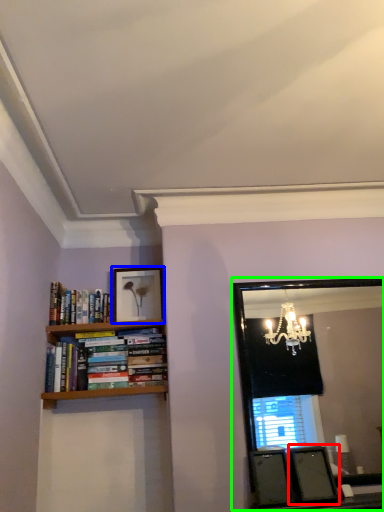
Question: Based on their relative distances, which object is farther from picture frame (highlighted by a red box)? Choose from picture frame (highlighted by a blue box) and mirror (highlighted by a green box).

Choices:
 (A) picture frame
 (B) mirror

Answer: (B)